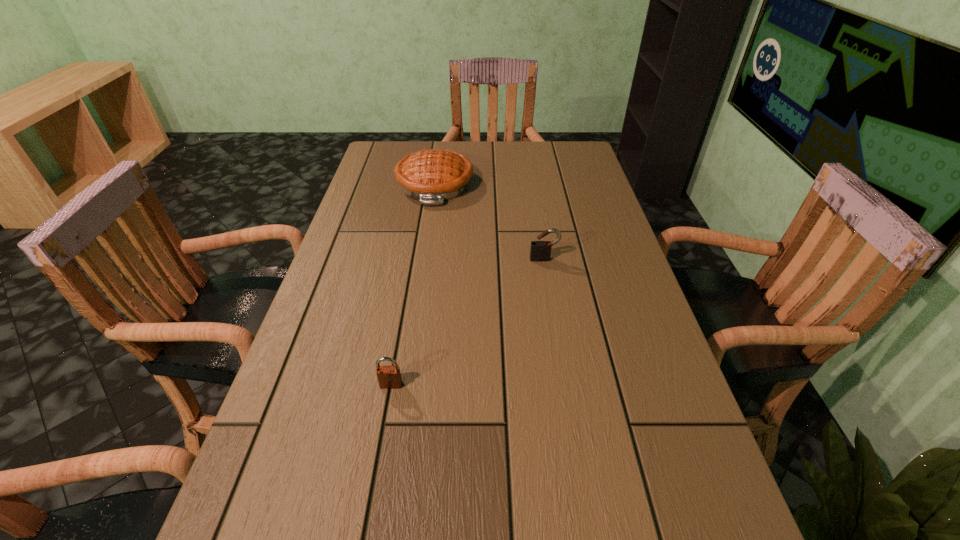
What are the coordinates of `pie` in the screenshot? It's located at (432, 176).

Find the location of a particular element. The height and width of the screenshot is (540, 960). the second farthest object is located at coordinates (540, 251).

This screenshot has width=960, height=540. I want to click on the farther padlock, so click(540, 251).

What are the coordinates of `the nearer padlock` in the screenshot? It's located at (389, 377).

Identify the location of the nearest object. The height and width of the screenshot is (540, 960). (389, 377).

Where is `blank space located 0.120m on the left of the farthest object`? This screenshot has height=540, width=960. blank space located 0.120m on the left of the farthest object is located at coordinates (360, 184).

Identify the location of vacant space located 0.050m with the keyhole on the front of the second nearest object. (547, 274).

The height and width of the screenshot is (540, 960). What are the coordinates of `blank space located on the front-facing side of the left padlock` in the screenshot? It's located at point(385,422).

The height and width of the screenshot is (540, 960). Identify the location of object that is positioned at the far edge. tap(432, 176).

Identify the location of object positioned at the left edge. Image resolution: width=960 pixels, height=540 pixels. (432, 176).